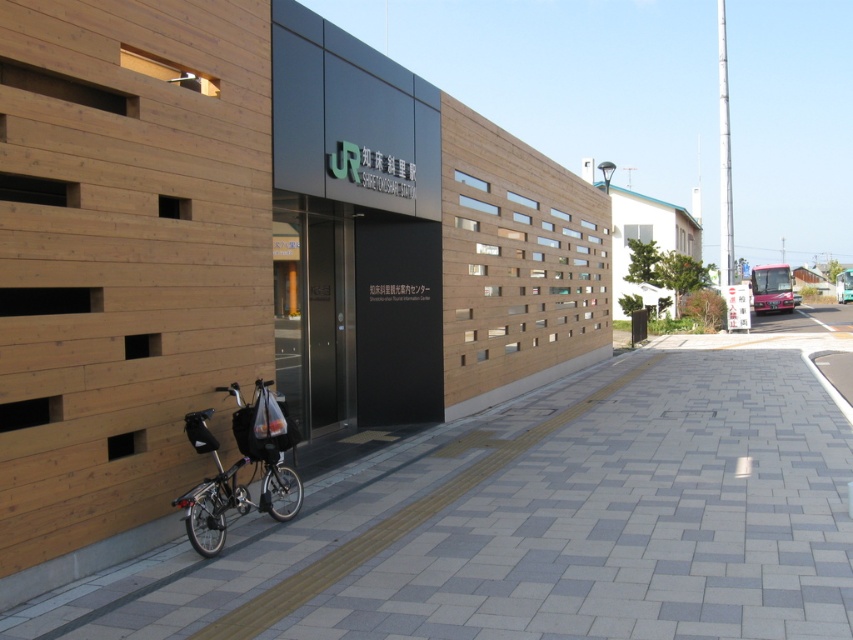
You are a delivery person who needs to park your shiny black bicycle at lower left near the gray concrete pavement at center. The parking space is 5 feet wide. Can your bicycle fit into the space?

The distance between the gray concrete pavement at center and the shiny black bicycle at lower left is 5.10 feet. Since the parking space is 5 feet wide, the bicycle cannot fit as it requires slightly more space.

You are standing in front of the building and want to place a small flower pot on the gray concrete pavement at center. However, there is a shiny black bicycle at lower left nearby. Based on their positions, can you tell if the bicycle is closer to you or farther away than the pavement?

The gray concrete pavement at center is closer to the viewer than the shiny black bicycle at lower left, so the bicycle is farther away than the pavement.